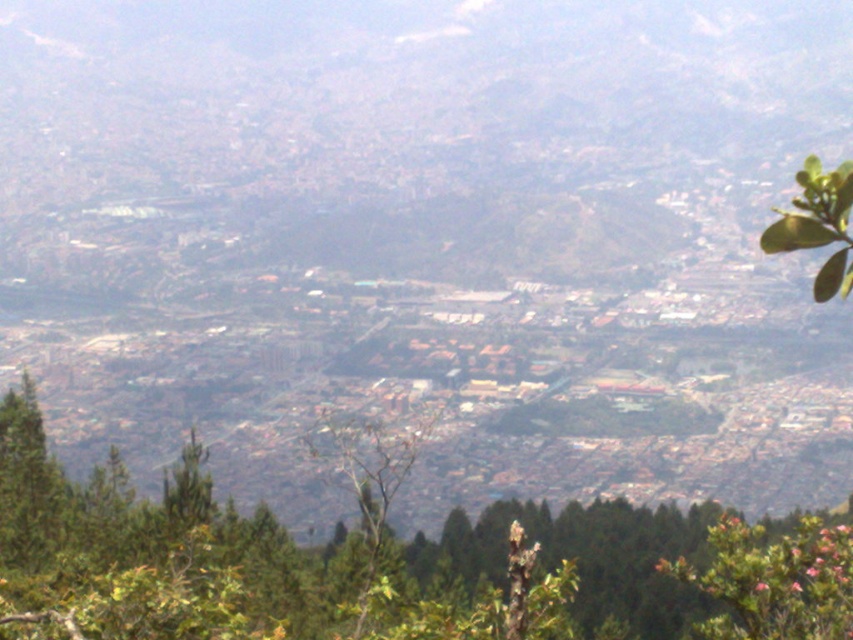
Question: Does green leafy tree at center have a lesser width compared to green leafy tree at upper right?

Choices:
 (A) yes
 (B) no

Answer: (B)

Question: Which of the following is the closest to the observer?

Choices:
 (A) (844, 182)
 (B) (91, 524)

Answer: (A)

Question: Among these points, which one is nearest to the camera?

Choices:
 (A) (467, 632)
 (B) (767, 230)

Answer: (B)

Question: Is green leafy tree at center above green leafy tree at upper right?

Choices:
 (A) yes
 (B) no

Answer: (B)

Question: Can you confirm if green leafy tree at center is positioned to the right of green leafy tree at upper right?

Choices:
 (A) no
 (B) yes

Answer: (A)